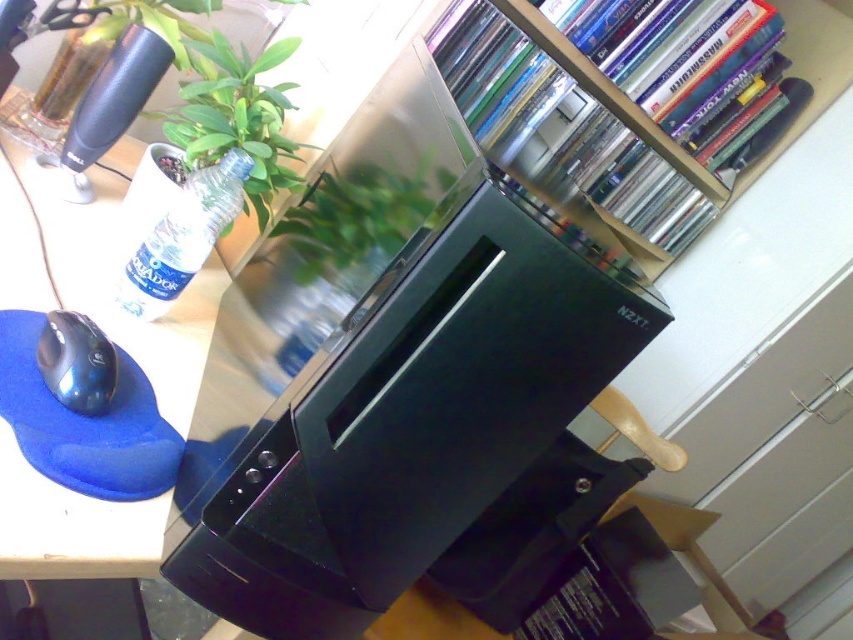
Question: Which object is the closest to the clear plastic bottle at upper left?

Choices:
 (A) black plastic computer case at center
 (B) black glossy mouse at lower left

Answer: (B)

Question: Is black plastic computer case at center thinner than black glossy mouse at lower left?

Choices:
 (A) no
 (B) yes

Answer: (A)

Question: Which object is the closest to the green leafy plant at upper left?

Choices:
 (A) blue foam mousepad at lower left
 (B) black glossy mouse at lower left
 (C) black plastic computer case at center
 (D) clear plastic bottle at upper left

Answer: (D)

Question: Where is blue foam mousepad at lower left located in relation to green leafy plant at upper left in the image?

Choices:
 (A) right
 (B) left

Answer: (B)

Question: Which is farther from the black plastic computer case at center?

Choices:
 (A) clear plastic bottle at upper left
 (B) green leafy plant at upper left

Answer: (A)

Question: Is blue foam mousepad at lower left positioned at the back of green leafy plant at upper left?

Choices:
 (A) yes
 (B) no

Answer: (B)